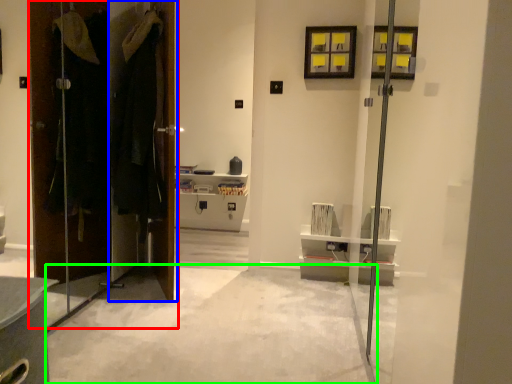
Question: Estimate the real-world distances between objects in this image. Which object is closer to door (highlighted by a red box), door (highlighted by a blue box) or concrete (highlighted by a green box)?

Choices:
 (A) door
 (B) concrete

Answer: (A)